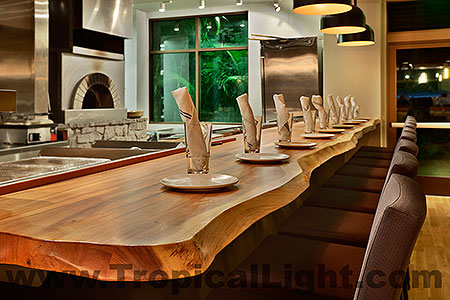
Where is `floor`? floor is located at coordinates (431, 229).